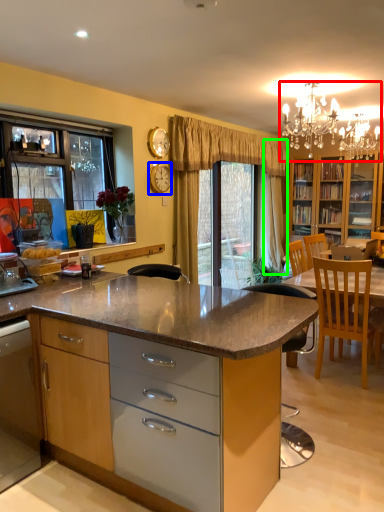
Question: Which object is the farthest from light fixture (highlighted by a red box)? Choose among these: clock (highlighted by a blue box) or curtain (highlighted by a green box).

Choices:
 (A) clock
 (B) curtain

Answer: (A)